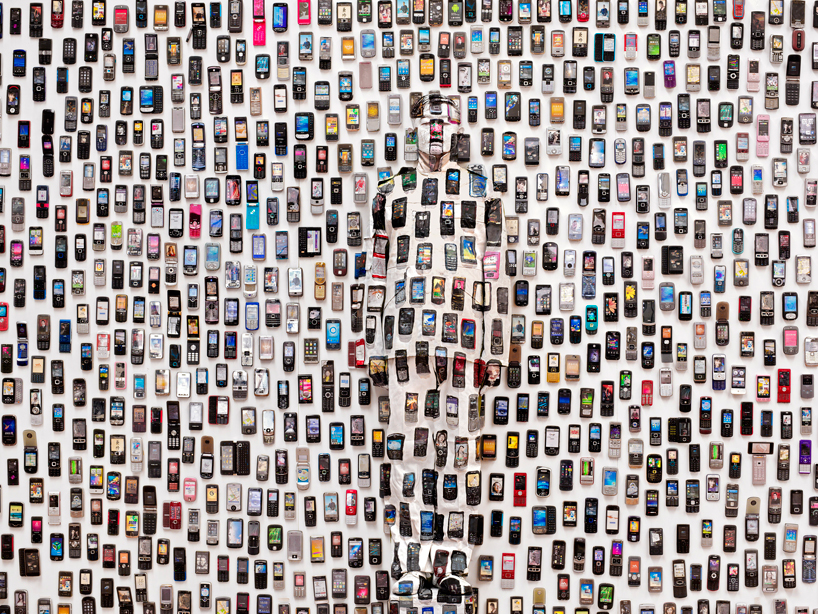
At what (x,y) coordinates should I click in order to perform the action: click on phone. Please return your answer as a coordinate pair (x, y). This screenshot has height=614, width=818. Looking at the image, I should click on [560, 556].